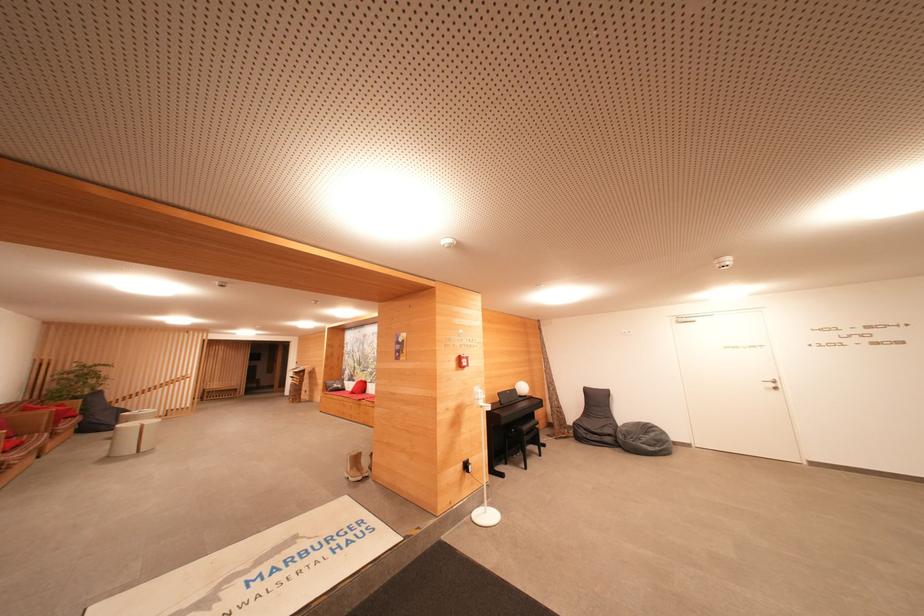
This screenshot has width=924, height=616. Describe the element at coordinates (527, 424) in the screenshot. I see `a chair sitting surface` at that location.